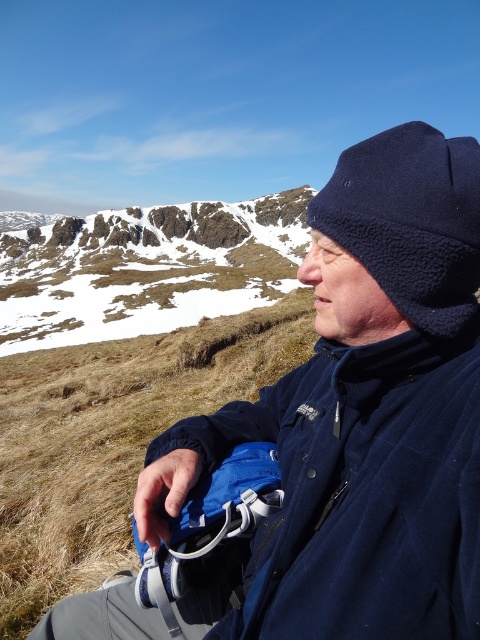
You are a hiker who wants to check the position of your backpack. You see the point at coordinates (361, 492). Is this point on your navy blue fleece jacket at center or on your blue backpack resting on your lap?

The point at coordinates (361, 492) is on the navy blue fleece jacket at center, so it is not on the blue backpack resting on your lap.

You are standing at the base of the snowy rocky mountain at upper left and want to reach the peak. If your average walking speed is 3 miles per hour, approximately how many minutes will it take you to reach the peak?

The snowy rocky mountain at upper left is 352.33 feet away from viewer. Converting feet to miles, 352.33 feet is approximately 0.0667 miles. At a speed of 3 miles per hour, the time required would be distance divided by speed, so 0.0667 miles divided by 3 mph equals approximately 0.0222 hours. Converting hours to minutes by multiplying by 60 gives roughly 1.33 minutes. Therefore, it would take about 1.33 minutes to reach the peak.